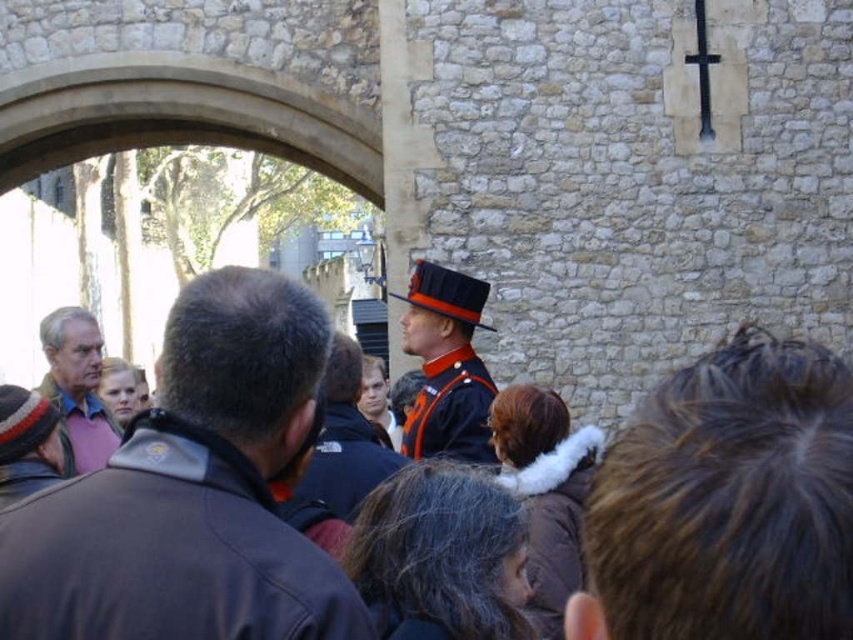
Question: Among these objects, which one is nearest to the camera?

Choices:
 (A) dark brown leather jacket at center
 (B) orange fabric uniform at center
 (C) pink fabric shirt at left

Answer: (A)

Question: In this image, where is dark brown leather jacket at center located relative to shiny blue uniform at center?

Choices:
 (A) below
 (B) above

Answer: (B)

Question: Considering the real-world distances, which object is farthest from the orange uniform at center?

Choices:
 (A) orange fabric uniform at center
 (B) pink fabric shirt at left
 (C) dark brown leather jacket at center
 (D) shiny blue uniform at center

Answer: (B)

Question: Does dark brown leather jacket at center appear over orange uniform at center?

Choices:
 (A) yes
 (B) no

Answer: (A)

Question: Is the position of orange uniform at center less distant than that of pink fabric shirt at left?

Choices:
 (A) yes
 (B) no

Answer: (A)

Question: Which point is closer to the camera?

Choices:
 (A) (90, 433)
 (B) (477, 406)
 (C) (234, 468)
 (D) (310, 493)

Answer: (C)